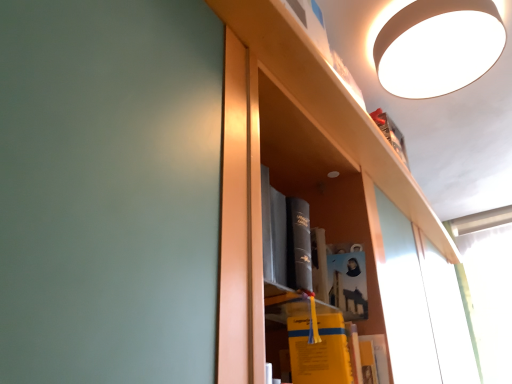
Question: From a real-world perspective, is matte paper book at center, marked as the second book in a bottom-to-top arrangement, below white matte lampshade at upper right?

Choices:
 (A) no
 (B) yes

Answer: (B)

Question: Does matte paper book at center, which is the first book from top to bottom, have a greater width compared to white matte lampshade at upper right?

Choices:
 (A) no
 (B) yes

Answer: (A)

Question: Can you confirm if matte paper book at center, marked as the second book in a bottom-to-top arrangement, is taller than white matte lampshade at upper right?

Choices:
 (A) no
 (B) yes

Answer: (B)

Question: From a real-world perspective, is matte paper book at center, marked as the second book in a bottom-to-top arrangement, located higher than white matte lampshade at upper right?

Choices:
 (A) no
 (B) yes

Answer: (A)

Question: Does matte paper book at center, marked as the second book in a bottom-to-top arrangement, touch white matte lampshade at upper right?

Choices:
 (A) yes
 (B) no

Answer: (B)

Question: In terms of width, does yellow matte book at center, which is the 2th book from top to bottom, look wider or thinner when compared to matte paper book at center, which is the first book from top to bottom?

Choices:
 (A) thin
 (B) wide

Answer: (B)

Question: Considering the positions of yellow matte book at center, the 1th book in the bottom-to-top sequence, and matte paper book at center, marked as the second book in a bottom-to-top arrangement, in the image, is yellow matte book at center, the 1th book in the bottom-to-top sequence, taller or shorter than matte paper book at center, marked as the second book in a bottom-to-top arrangement,?

Choices:
 (A) tall
 (B) short

Answer: (B)

Question: From the image's perspective, is yellow matte book at center, the 1th book in the bottom-to-top sequence, above or below matte paper book at center, marked as the second book in a bottom-to-top arrangement?

Choices:
 (A) above
 (B) below

Answer: (B)

Question: From a real-world perspective, is yellow matte book at center, which is the 2th book from top to bottom, physically located above or below matte paper book at center, marked as the second book in a bottom-to-top arrangement?

Choices:
 (A) below
 (B) above

Answer: (A)

Question: Considering the positions of point (407, 31) and point (338, 306), is point (407, 31) closer or farther from the camera than point (338, 306)?

Choices:
 (A) farther
 (B) closer

Answer: (A)

Question: From the image's perspective, relative to matte paper book at center, marked as the second book in a bottom-to-top arrangement, is white matte lampshade at upper right above or below?

Choices:
 (A) above
 (B) below

Answer: (A)

Question: From a real-world perspective, is white matte lampshade at upper right above or below matte paper book at center, marked as the second book in a bottom-to-top arrangement?

Choices:
 (A) below
 (B) above

Answer: (B)

Question: Would you say white matte lampshade at upper right is to the left or to the right of matte paper book at center, which is the first book from top to bottom, in the picture?

Choices:
 (A) left
 (B) right

Answer: (B)

Question: Would you say white matte lampshade at upper right is inside or outside yellow matte book at center, the 1th book in the bottom-to-top sequence?

Choices:
 (A) outside
 (B) inside

Answer: (A)

Question: Is white matte lampshade at upper right in front of or behind yellow matte book at center, which is the 2th book from top to bottom, in the image?

Choices:
 (A) front
 (B) behind

Answer: (B)